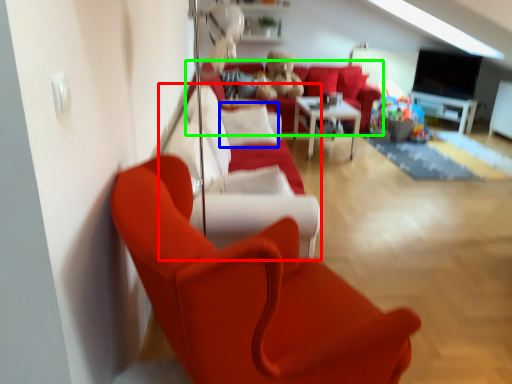
Question: Considering the real-world distances, which object is closest to couch (highlighted by a red box)? pillow (highlighted by a blue box) or studio couch (highlighted by a green box).

Choices:
 (A) pillow
 (B) studio couch

Answer: (A)